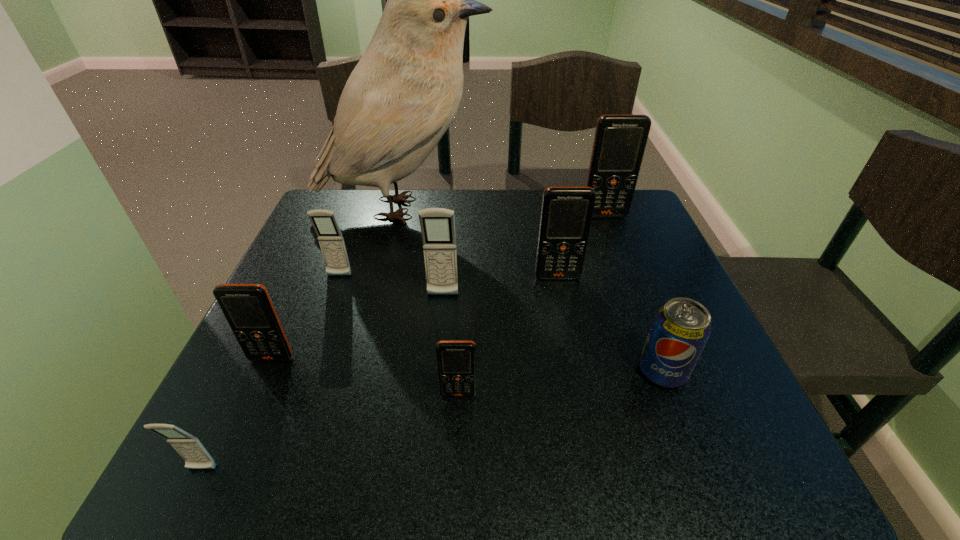
Locate an element on the screen. The height and width of the screenshot is (540, 960). cellular telephone identified as the closest to the second nearest cellular telephone is located at coordinates (437, 225).

Select which cellular telephone is the third closest to the fourth nearest cellular telephone. Please provide its 2D coordinates. Your answer should be formatted as a tuple, i.e. [(x, y)], where the tuple contains the x and y coordinates of a point satisfying the conditions above.

[(456, 359)]

Image resolution: width=960 pixels, height=540 pixels. I want to click on orange cellular telephone that is the third closest to the leftmost orange cellular telephone, so click(x=620, y=140).

Locate which orange cellular telephone is the closest to the third smallest orange cellular telephone. Please provide its 2D coordinates. Your answer should be formatted as a tuple, i.e. [(x, y)], where the tuple contains the x and y coordinates of a point satisfying the conditions above.

[(620, 140)]

Where is `gray cellular telephone identified as the closest to the soda`? Image resolution: width=960 pixels, height=540 pixels. gray cellular telephone identified as the closest to the soda is located at coordinates (437, 225).

Identify which gray cellular telephone is the second nearest to the second biggest gray cellular telephone. Please provide its 2D coordinates. Your answer should be formatted as a tuple, i.e. [(x, y)], where the tuple contains the x and y coordinates of a point satisfying the conditions above.

[(189, 447)]

Where is `free location that satisfies the following two spatial constraints: 1. on the front-facing side of the third cellular telephone from left to right; 2. on the right side of the soda`? The width and height of the screenshot is (960, 540). free location that satisfies the following two spatial constraints: 1. on the front-facing side of the third cellular telephone from left to right; 2. on the right side of the soda is located at coordinates (304, 372).

The height and width of the screenshot is (540, 960). What are the coordinates of `vacant space that satisfies the following two spatial constraints: 1. on the screen of the soda; 2. on the right side of the second smallest orange cellular telephone` in the screenshot? It's located at (266, 372).